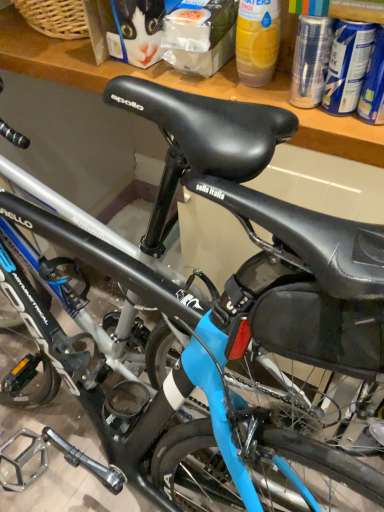
The width and height of the screenshot is (384, 512). I want to click on yellow matte plastic bottle at upper right, so click(x=257, y=41).

Describe the element at coordinates (257, 41) in the screenshot. I see `yellow matte plastic bottle at upper right` at that location.

You are a GUI agent. You are given a task and a screenshot of the screen. Output one action in this format:
    pyautogui.click(x=<x>, y=<y>)
    Task: Click on the yellow matte plastic bottle at upper right
    
    Given the screenshot: What is the action you would take?
    pyautogui.click(x=257, y=41)